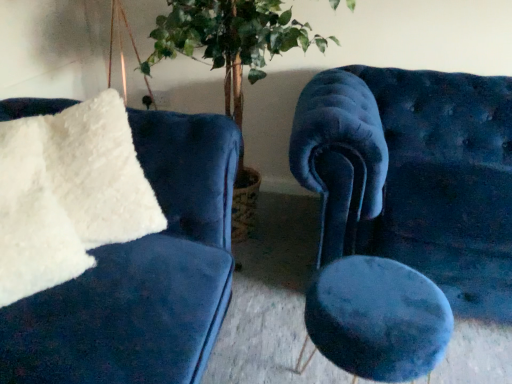
The image size is (512, 384). In order to click on velvet blue stool at center in this screenshot , I will do `click(378, 318)`.

Where is `velvet blue stool at center`? velvet blue stool at center is located at coordinates (378, 318).

Would you say green leafy plant at center is inside or outside white fluffy pillow at left?

green leafy plant at center exists outside the volume of white fluffy pillow at left.

Does green leafy plant at center have a smaller size compared to white fluffy pillow at left?

No, green leafy plant at center is not smaller than white fluffy pillow at left.

Based on the photo, how much distance is there between green leafy plant at center and white fluffy pillow at left?

60.48 centimeters.

Can you see green leafy plant at center touching white fluffy pillow at left?

No, green leafy plant at center is not making contact with white fluffy pillow at left.

Considering the relative sizes of white fluffy pillow at left and velvet blue chair at right in the image provided, is white fluffy pillow at left shorter than velvet blue chair at right?

Indeed, white fluffy pillow at left has a lesser height compared to velvet blue chair at right.

Is white fluffy pillow at left outside of velvet blue chair at right?

Yes, white fluffy pillow at left is not within velvet blue chair at right.

From a real-world perspective, is white fluffy pillow at left beneath velvet blue chair at right?

Actually, white fluffy pillow at left is physically above velvet blue chair at right in the real world.

Is velvet blue chair at right inside or outside of velvet blue stool at center?

velvet blue chair at right lies outside velvet blue stool at center.

Who is shorter, velvet blue chair at right or velvet blue stool at center?

With less height is velvet blue stool at center.

The image size is (512, 384). I want to click on stool located below the velvet blue chair at right (from the image's perspective), so click(x=378, y=318).

How different are the orientations of velvet blue chair at right and green leafy plant at center in degrees?

The angular difference between velvet blue chair at right and green leafy plant at center is 0.0752 degrees.

Is velvet blue chair at right spatially inside green leafy plant at center, or outside of it?

velvet blue chair at right exists outside the volume of green leafy plant at center.

Is velvet blue chair at right far away from green leafy plant at center?

No, velvet blue chair at right is not far away from green leafy plant at center.

Find the location of a particular element. The height and width of the screenshot is (384, 512). pillow lying on the left of velvet blue stool at center is located at coordinates (100, 173).

Which is in front, velvet blue stool at center or white fluffy pillow at left?

Positioned in front is white fluffy pillow at left.

From the image's perspective, is velvet blue chair at right under white fluffy pillow at left?

Indeed, from the image's perspective, velvet blue chair at right is shown beneath white fluffy pillow at left.

From a real-world perspective, which object stands above the other?

In real-world perspective, white fluffy pillow at left is above.

Is point (455, 169) closer to viewer compared to point (129, 149)?

No, (455, 169) is further to viewer.

From the image's perspective, which is above, velvet blue stool at center or green leafy plant at center?

green leafy plant at center.

Does velvet blue stool at center appear on the right side of green leafy plant at center?

Indeed, velvet blue stool at center is positioned on the right side of green leafy plant at center.

Between velvet blue stool at center and green leafy plant at center, which one has smaller size?

velvet blue stool at center.

This screenshot has width=512, height=384. I want to click on houseplant located underneath the white fluffy pillow at left (from a real-world perspective), so click(230, 40).

Find the location of `pillow in front of the velvet blue chair at right`. pillow in front of the velvet blue chair at right is located at coordinates (100, 173).

Looking at the image, which one is located further to velvet blue stool at center, velvet blue chair at right or green leafy plant at center?

The object further to velvet blue stool at center is green leafy plant at center.

Looking at this image, looking at the image, which one is located closer to white fluffy pillow at left, green leafy plant at center or velvet blue stool at center?

velvet blue stool at center lies closer to white fluffy pillow at left than the other object.

Based on their spatial positions, is velvet blue chair at right or velvet blue stool at center further from green leafy plant at center?

velvet blue stool at center is positioned further to the anchor green leafy plant at center.

Consider the image. Considering their positions, is velvet blue stool at center positioned closer to velvet blue chair at right than white fluffy pillow at left?

Based on the image, velvet blue stool at center appears to be nearer to velvet blue chair at right.

Which object lies nearer to the anchor point white fluffy pillow at left, velvet blue chair at right or green leafy plant at center?

green leafy plant at center.

From the image, which object appears to be farther from green leafy plant at center, white fluffy pillow at left or velvet blue stool at center?

velvet blue stool at center is further to green leafy plant at center.

When comparing their distances from velvet blue chair at right, does green leafy plant at center or velvet blue stool at center seem further?

Based on the image, green leafy plant at center appears to be further to velvet blue chair at right.

In the scene shown: Which object lies nearer to the anchor point green leafy plant at center, white fluffy pillow at left or velvet blue chair at right?

velvet blue chair at right.

Locate an element on the screen. The image size is (512, 384). stool located between green leafy plant at center and velvet blue chair at right in the left-right direction is located at coordinates (378, 318).

Where is `stool situated between white fluffy pillow at left and velvet blue chair at right from left to right`? This screenshot has height=384, width=512. stool situated between white fluffy pillow at left and velvet blue chair at right from left to right is located at coordinates (378, 318).

Locate an element on the screen. This screenshot has width=512, height=384. houseplant located between white fluffy pillow at left and velvet blue stool at center in the left-right direction is located at coordinates (230, 40).

The height and width of the screenshot is (384, 512). Identify the location of houseplant between white fluffy pillow at left and velvet blue chair at right from left to right. (230, 40).